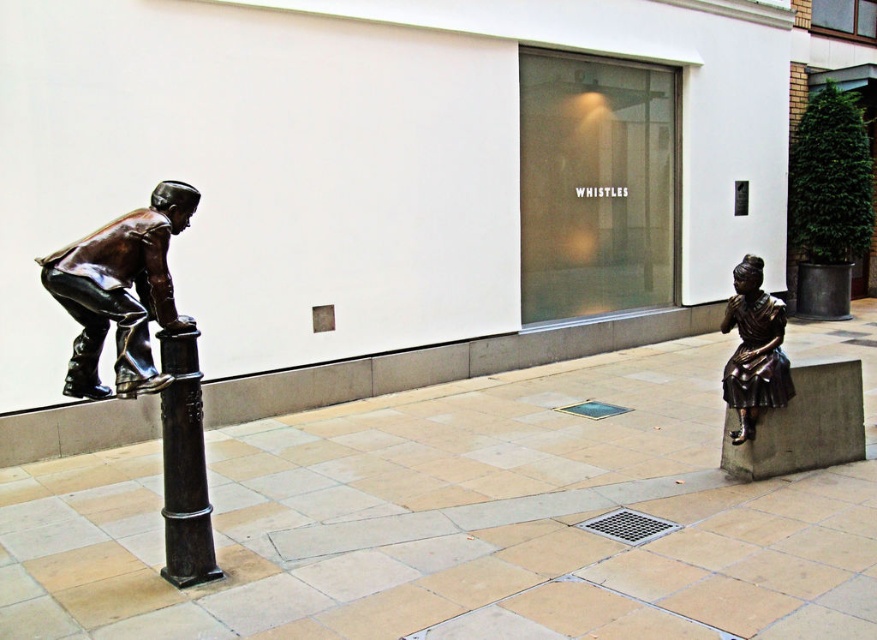
Based on the photo, you are standing in front of the modern building with the large glass window displaying the word WHISTLES. You see the bronze textured pole at left and the bronze statue at lower right. Which object is positioned further to the left?

The bronze textured pole at left is positioned further to the left than the bronze statue at lower right.

From the picture: You are an art curator planning to move the bronze statue at lower right closer to the bronze textured pole at left. Considering their sizes, which object will require more space when moving? Explain your reasoning.

The bronze textured pole at left requires more space when moving because it is larger in size than the bronze statue at lower right.